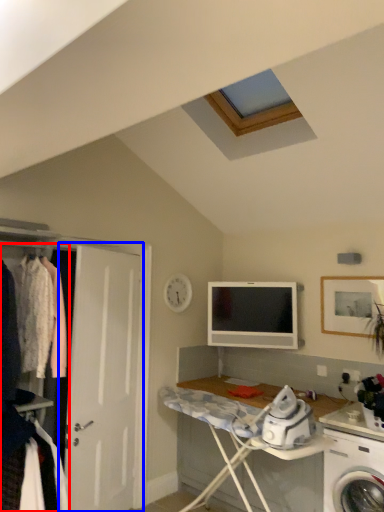
Question: Which object is closer to the camera taking this photo, closet (highlighted by a red box) or door (highlighted by a blue box)?

Choices:
 (A) closet
 (B) door

Answer: (A)